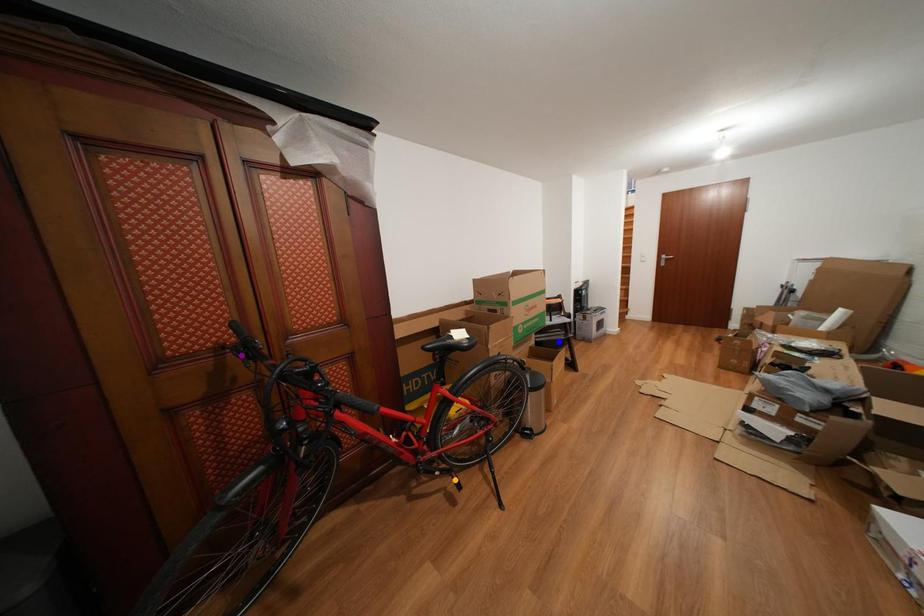
Order these from nearest to farthest:
- blue point
- orange point
- purple point

1. purple point
2. orange point
3. blue point